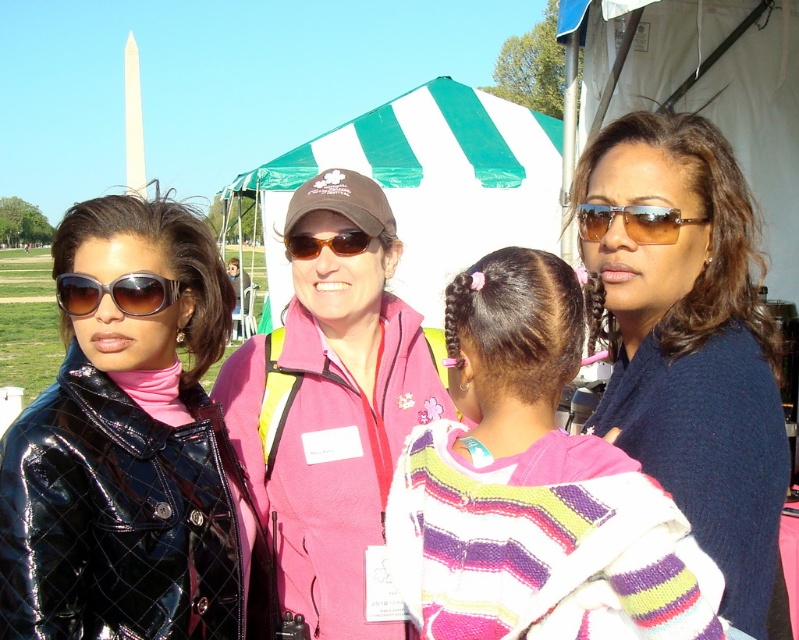
You are planning to set up a temporary shelter for an event and need to choose between the green striped canopy at center and the white fabric canopy at upper center. Based on their sizes, which one would provide more coverage area?

The green striped canopy at center has a larger size compared to the white fabric canopy at upper center, so it would provide more coverage area.

You are organizing a photo shoot and need to arrange the models so that the shorter item is in front to avoid blocking the view. Which of the two items, the matte blue sweater at center or the pink fleece jacket at center, should be placed in front?

The matte blue sweater at center is shorter than the pink fleece jacket at center, so it should be placed in front to avoid blocking the view.